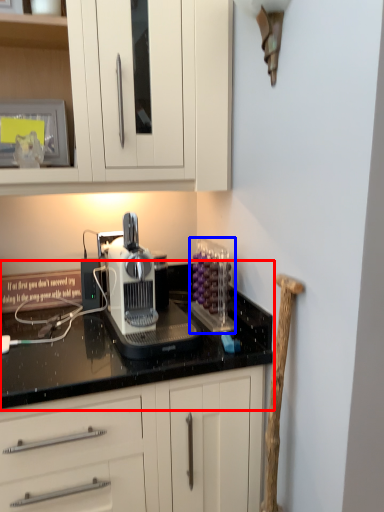
Question: Which object is closer to the camera taking this photo, countertop (highlighted by a red box) or kitchen appliance (highlighted by a blue box)?

Choices:
 (A) countertop
 (B) kitchen appliance

Answer: (A)